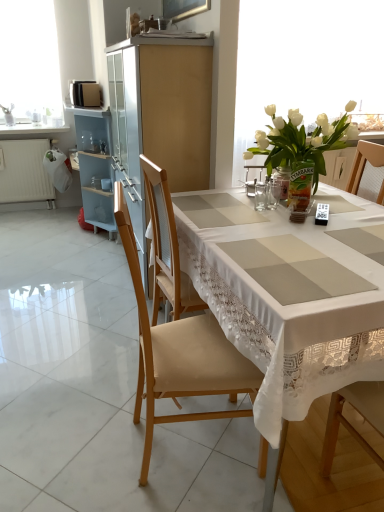
Locate an element on the screen. The image size is (384, 512). free area in between wooden chair at center, marked as the first chair in a front-to-back arrangement, and white matte radiator at left is located at coordinates (77, 286).